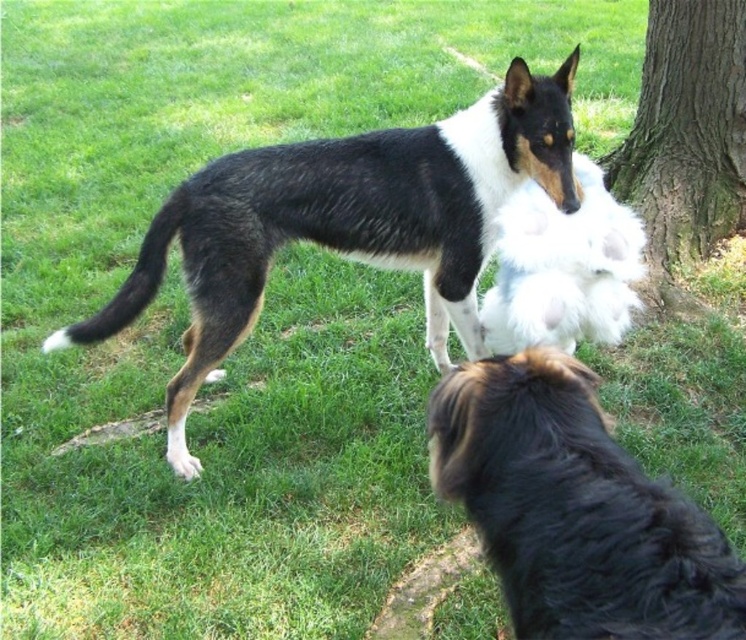
Question: Is black and white fur at center above black fluffy dog at lower right?

Choices:
 (A) no
 (B) yes

Answer: (B)

Question: Which point is closer to the camera taking this photo?

Choices:
 (A) (501, 224)
 (B) (700, 205)

Answer: (A)

Question: Which point is farther from the camera taking this photo?

Choices:
 (A) (263, 173)
 (B) (583, 184)
 (C) (686, 627)

Answer: (A)

Question: Does black fluffy dog at lower right appear over brown rough bark tree at right?

Choices:
 (A) yes
 (B) no

Answer: (B)

Question: Which of the following is the closest to the observer?

Choices:
 (A) black and white fur at center
 (B) black fluffy dog at lower right

Answer: (B)

Question: Can you confirm if brown rough bark tree at right is positioned below fluffy white stuffed toy at center?

Choices:
 (A) yes
 (B) no

Answer: (B)